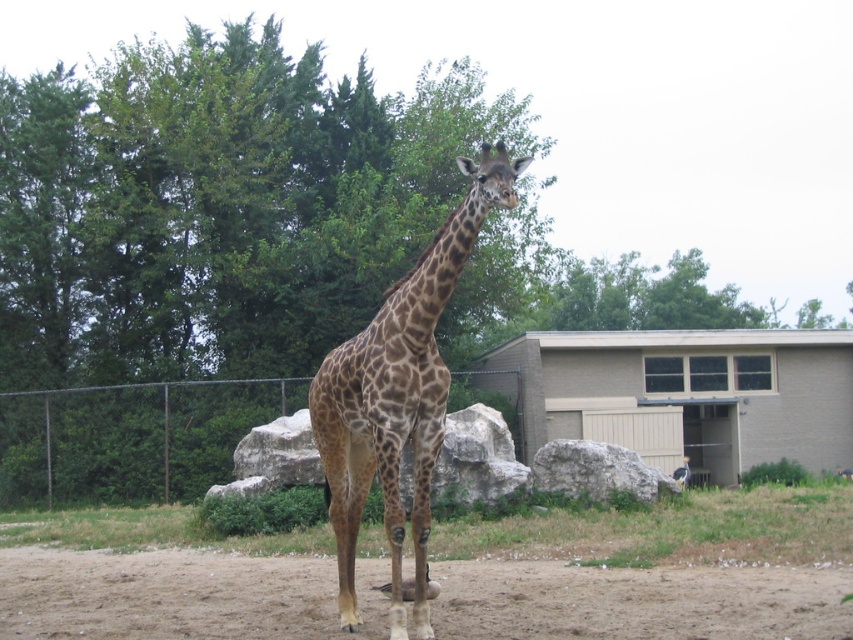
You are a zookeeper planning to place a new feeding station in the enclosure. The feeding station requires a clear space of 2 meters in front of it. Given the current position of the spotted fur giraffe at center, which is at point 0.623, 0.468, can you determine if the area directly in front of the giraffe is suitable for placing the feeding station?

The spotted fur giraffe at center is positioned at coordinates (398,397). The area directly in front of it would need to be assessed for clearance. However, without specific spatial data about the enclosure layout beyond the giraffe, such as the location of the chain link fence or rocks, it is not possible to confirm if the 2 meter space is available. Additional measurements of the enclosure are required before deciding the feeding station placement.